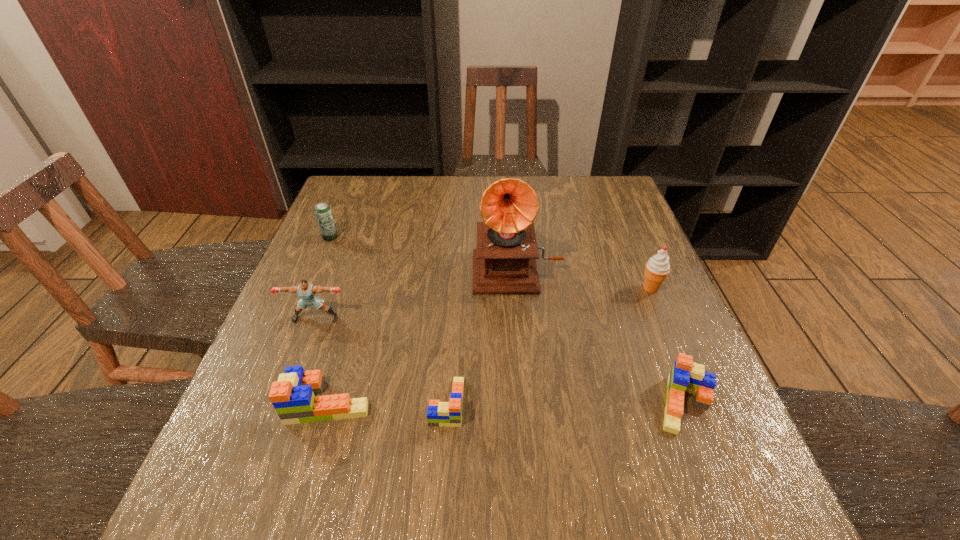
I want to click on Lego positioned at the right edge, so click(x=687, y=376).

What are the coordinates of `icecream that is at the right edge` in the screenshot? It's located at (657, 268).

Locate an element on the screen. The width and height of the screenshot is (960, 540). object situated at the near left corner is located at coordinates 292,396.

Identify the location of object that is at the near right corner. This screenshot has height=540, width=960. (687, 376).

Where is `blank space at the far edge of the desktop`? blank space at the far edge of the desktop is located at coordinates (458, 178).

Find the location of a particular element. vacant space at the near edge of the desktop is located at coordinates (620, 434).

In the image, there is a desktop. What are the coordinates of `blank space at the left edge` in the screenshot? It's located at (285, 344).

Identify the location of vacant position at the right edge of the desktop. (610, 294).

Locate an element on the screen. Image resolution: width=960 pixels, height=540 pixels. vacant area at the far right corner is located at coordinates (594, 208).

Locate an element on the screen. free spot between the icecream and the third object from right to left is located at coordinates (584, 278).